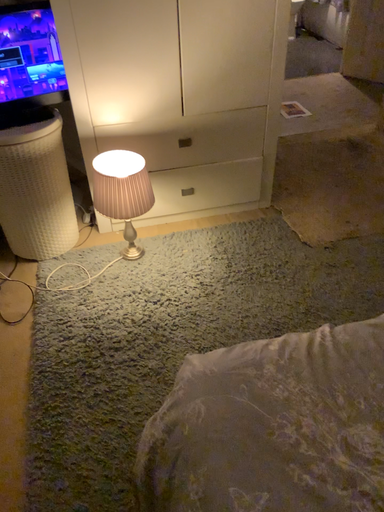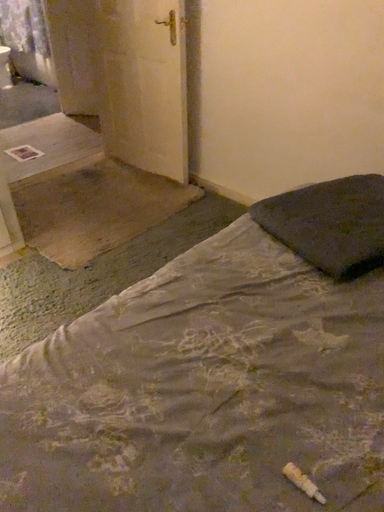
Question: Which way did the camera rotate in the video?

Choices:
 (A) rotated left
 (B) rotated right

Answer: (B)